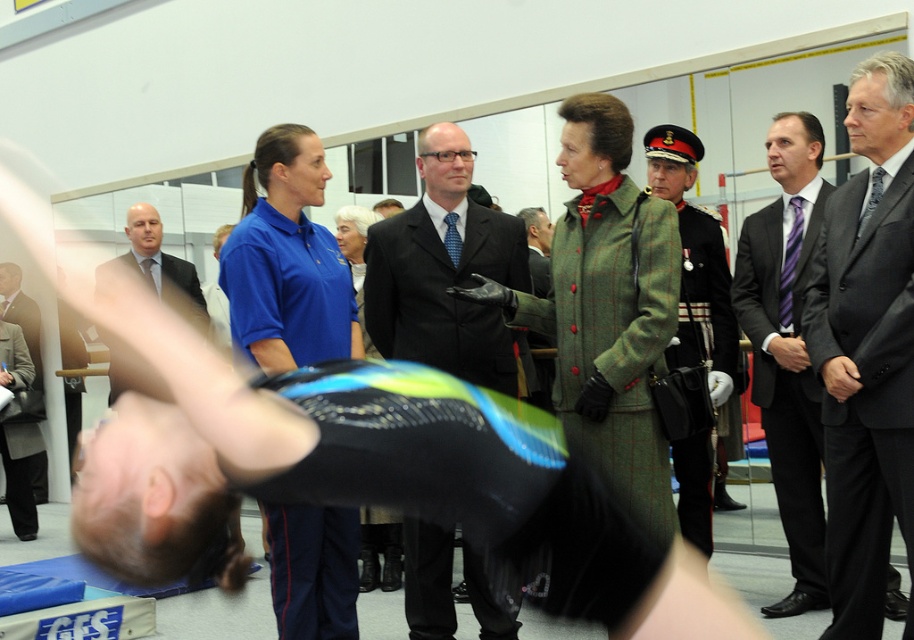
Question: Is dark gray suit at center in front of black suit at center?

Choices:
 (A) yes
 (B) no

Answer: (A)

Question: Does dark gray suit at center appear on the left side of purple striped tie at center?

Choices:
 (A) no
 (B) yes

Answer: (A)

Question: In this image, where is black suit at center located relative to purple striped tie at center?

Choices:
 (A) below
 (B) above

Answer: (B)

Question: Which of the following is the closest to the observer?

Choices:
 (A) (788, 384)
 (B) (153, 384)
 (C) (853, 552)
 (D) (438, 193)

Answer: (C)

Question: Which is farther from the dark gray suit at center?

Choices:
 (A) black suit at center
 (B) matte black suit at left

Answer: (B)

Question: Which object appears farthest from the camera in this image?

Choices:
 (A) black suit at center
 (B) matte black suit at left
 (C) dark gray suit at center

Answer: (A)